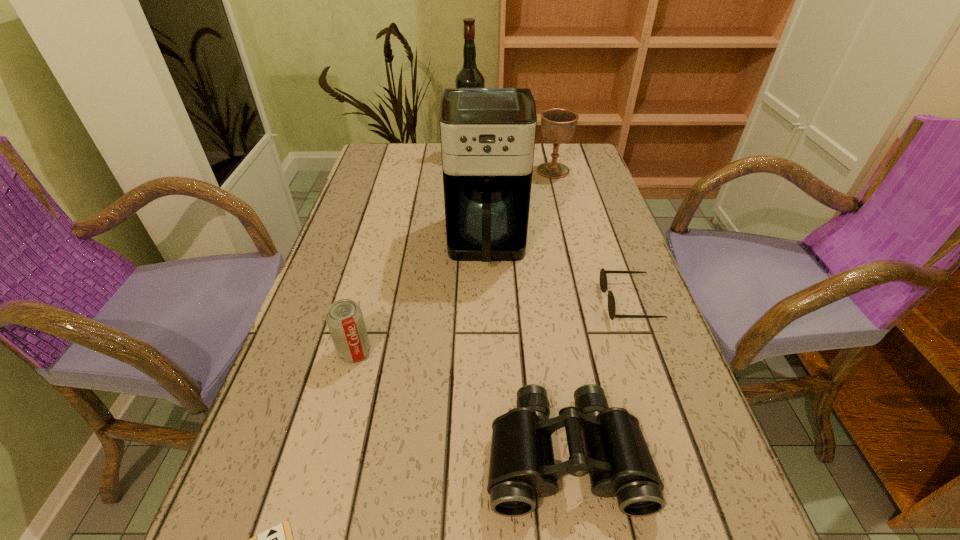
Where is `wine bottle`? Image resolution: width=960 pixels, height=540 pixels. wine bottle is located at coordinates (469, 76).

Where is `the fifth nearest object`? This screenshot has width=960, height=540. the fifth nearest object is located at coordinates (487, 134).

Find the location of a particular element. The width and height of the screenshot is (960, 540). the fifth shortest object is located at coordinates (558, 125).

Identify the location of chalice. (558, 125).

You are a GUI agent. You are given a task and a screenshot of the screen. Output one action in this format:
    pyautogui.click(x=<x>, y=<y>)
    Task: Click on the third nearest object
    
    Given the screenshot: What is the action you would take?
    (x=344, y=318)

Locate an element on the screen. soda can is located at coordinates (344, 318).

You are a GUI agent. You are given a task and a screenshot of the screen. Output one action in this format:
    pyautogui.click(x=<x>, y=<y>)
    Task: Click on the second nearest object
    
    Given the screenshot: What is the action you would take?
    pyautogui.click(x=522, y=466)

The height and width of the screenshot is (540, 960). I want to click on binoculars, so click(522, 466).

The height and width of the screenshot is (540, 960). Identify the location of sunglasses. (603, 277).

Where is `the sixth tallest object`? The image size is (960, 540). the sixth tallest object is located at coordinates (603, 277).